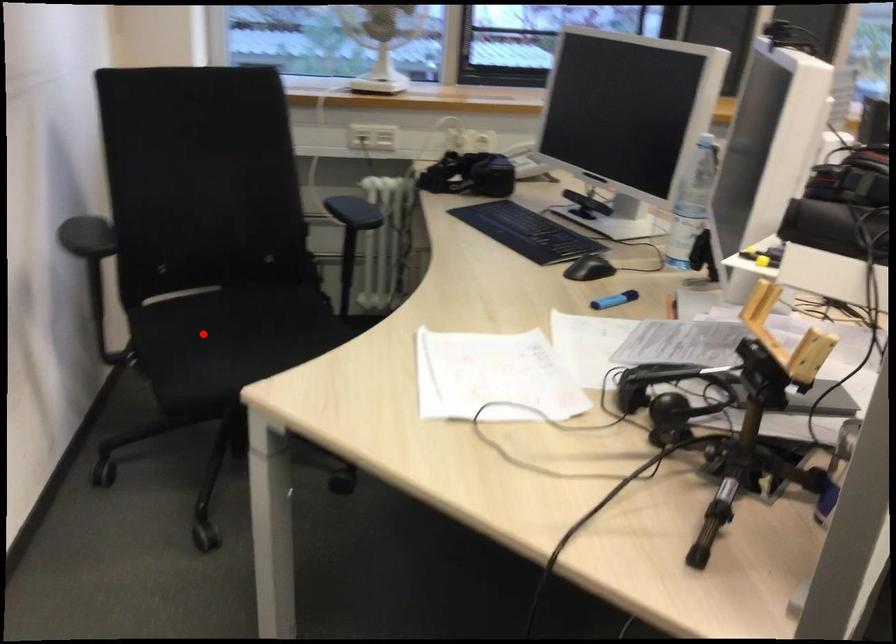
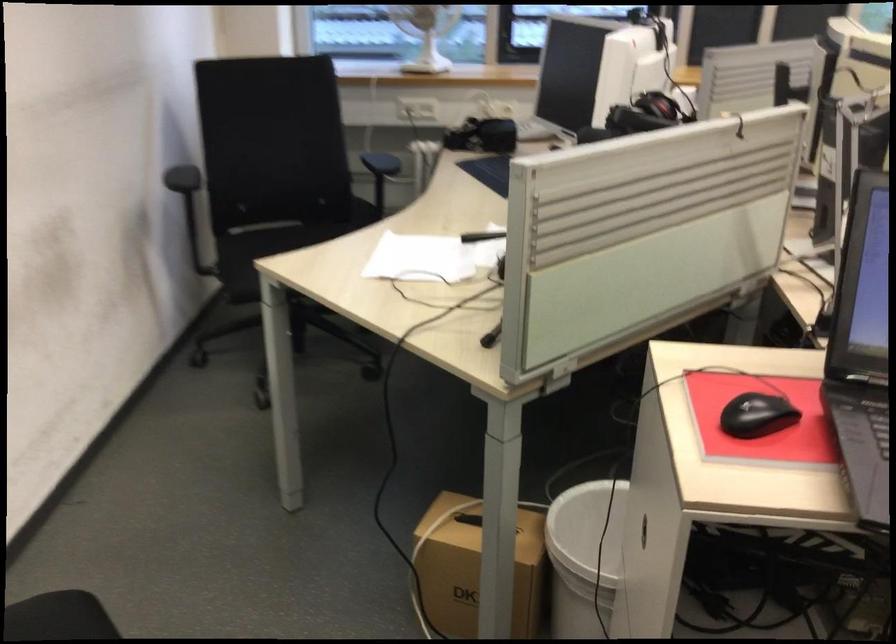
Question: I am providing you with two images of the same scene from different viewpoints. Image1 has a red point marked. In image2, the corresponding 3D location appears at what relative position? Reply with the corresponding letter.

Choices:
 (A) Closer
 (B) Farther

Answer: (B)